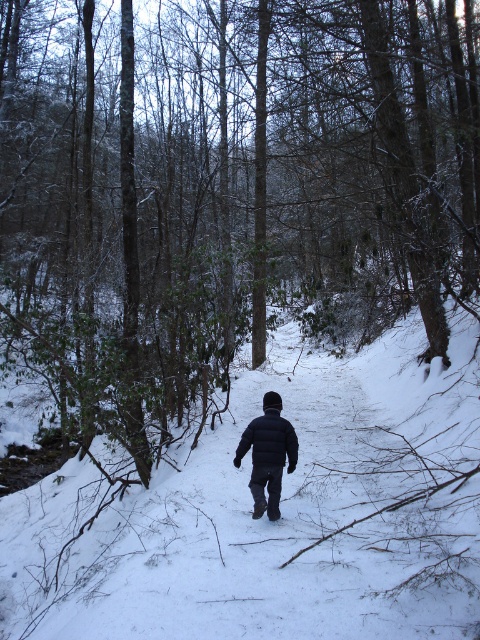
Question: Is white powdery snow at center closer to camera compared to matte black jacket at center?

Choices:
 (A) yes
 (B) no

Answer: (A)

Question: Is white powdery snow at center positioned before matte black jacket at center?

Choices:
 (A) yes
 (B) no

Answer: (A)

Question: Which point is closer to the camera?

Choices:
 (A) (285, 429)
 (B) (451, 561)
 (C) (276, 465)

Answer: (B)

Question: Which of the following is the closest to the observer?

Choices:
 (A) matte black jacket at center
 (B) dark blue puffy jacket at center
 (C) white powdery snow at center

Answer: (C)

Question: Is white powdery snow at center to the right of matte black jacket at center from the viewer's perspective?

Choices:
 (A) no
 (B) yes

Answer: (B)

Question: Which point is closer to the camera taking this photo?

Choices:
 (A) (286, 440)
 (B) (427, 506)
 (C) (288, 420)

Answer: (B)